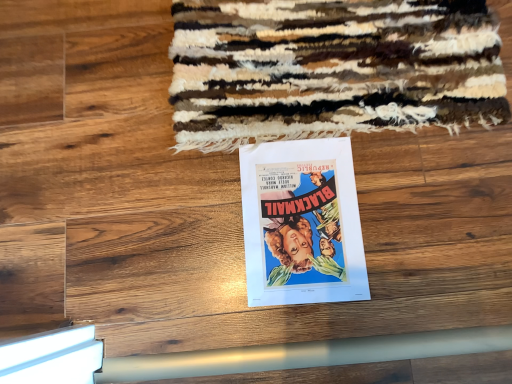
Identify the location of free space in front of matte paper poster at center. [x=317, y=318].